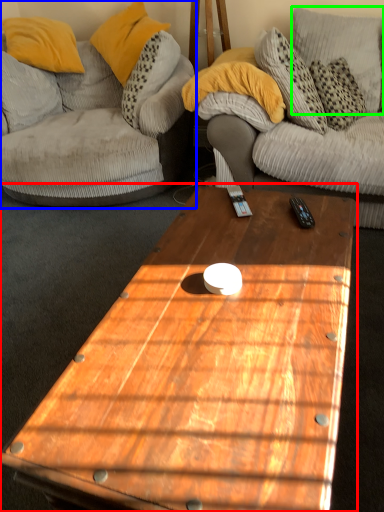
Question: Which object is the closest to the coffee table (highlighted by a red box)? Choose among these: studio couch (highlighted by a blue box) or pillow (highlighted by a green box).

Choices:
 (A) studio couch
 (B) pillow

Answer: (A)